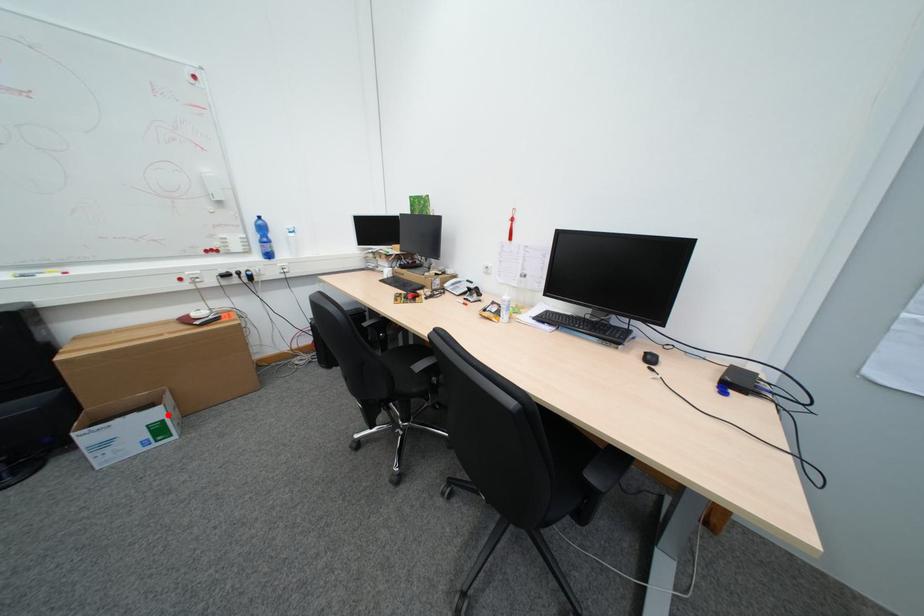
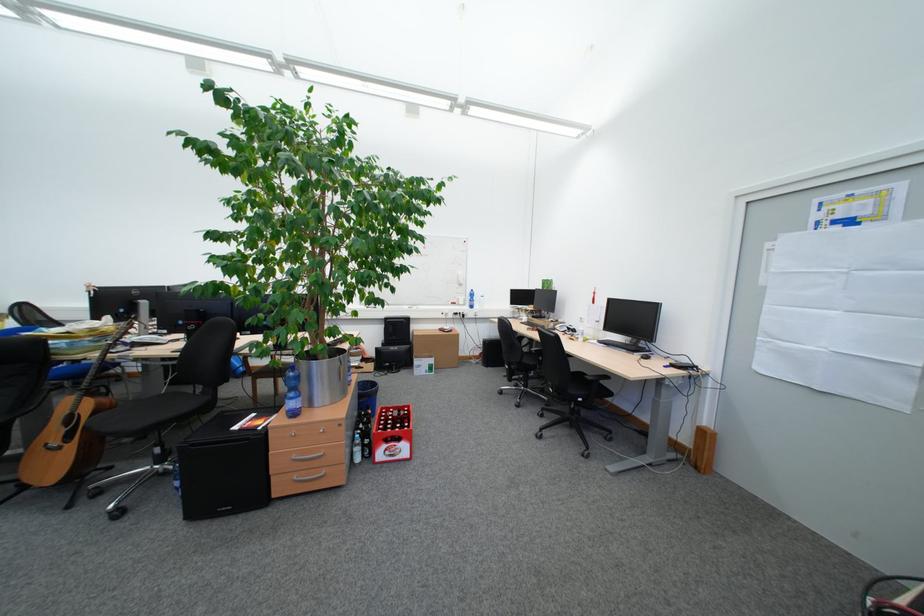
Question: I am providing you with two images of the same scene from different viewpoints. A red point is shown in image1. For the corresponding object point in image2, is it positioned nearer or farther from the camera?

Choices:
 (A) Nearer
 (B) Farther

Answer: (B)